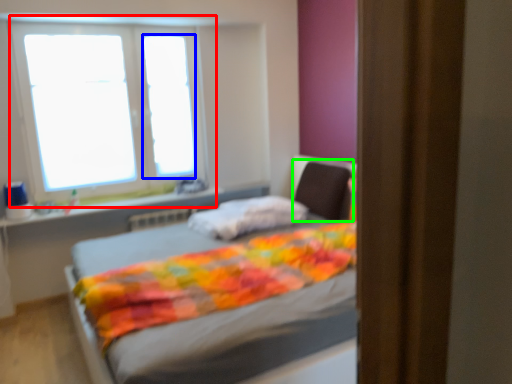
Question: Estimate the real-world distances between objects in this image. Which object is closer to window (highlighted by a red box), window screen (highlighted by a blue box) or swivel chair (highlighted by a green box)?

Choices:
 (A) window screen
 (B) swivel chair

Answer: (A)